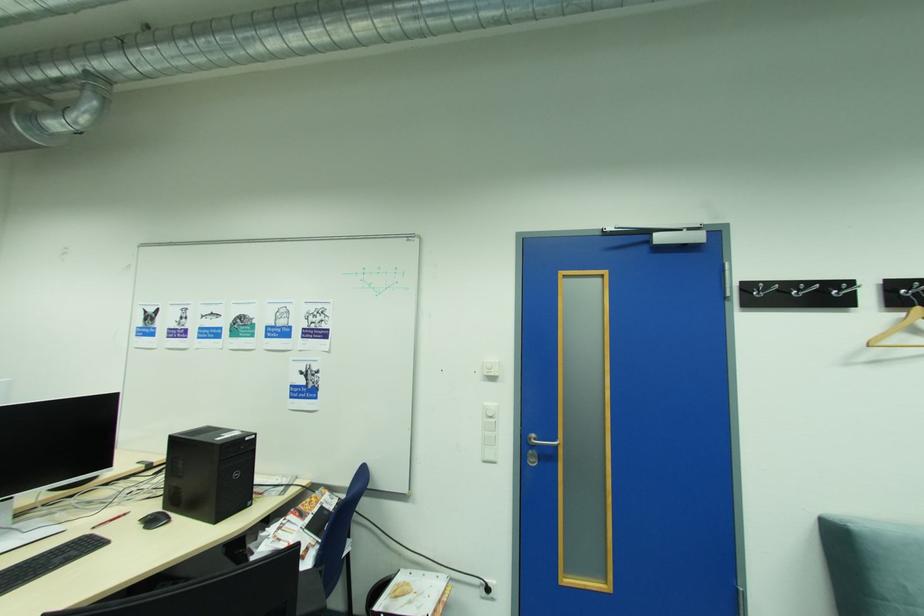
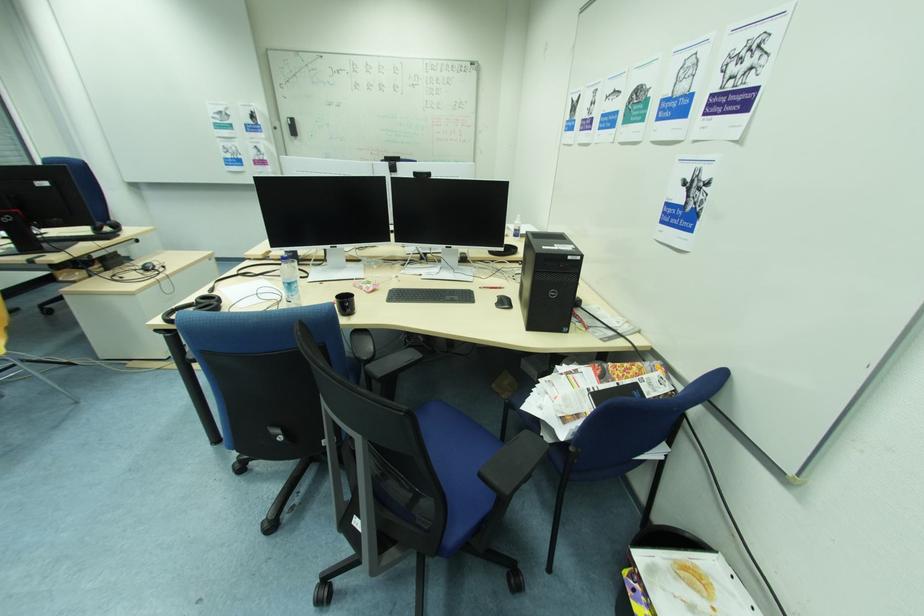
Locate, in the second image, the point that corresponds to point (151, 528) in the first image.

(503, 305)